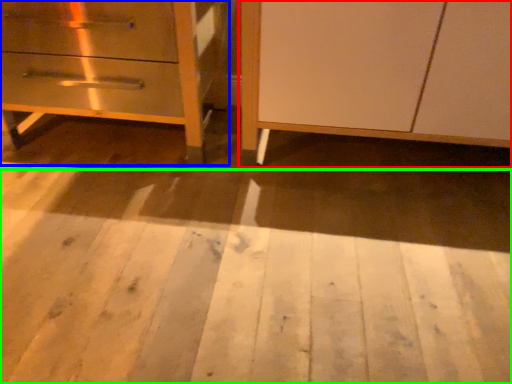
Question: Based on their relative distances, which object is farther from furniture (highlighted by a red box)? Choose from chest of drawers (highlighted by a blue box) and plywood (highlighted by a green box).

Choices:
 (A) chest of drawers
 (B) plywood

Answer: (A)